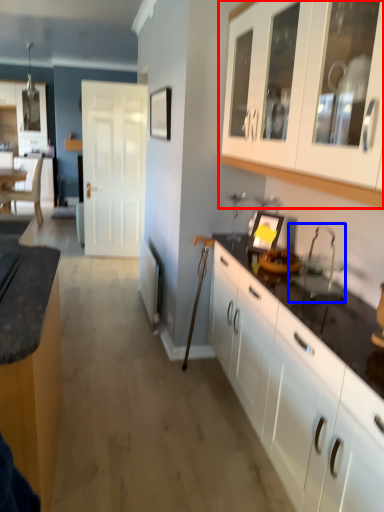
Question: Which of the following is the closest to the observer, cabinetry (highlighted by a red box) or sink (highlighted by a blue box)?

Choices:
 (A) cabinetry
 (B) sink

Answer: (A)